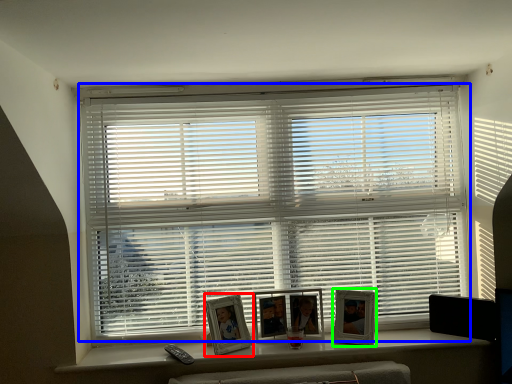
Question: Based on their relative distances, which object is nearer to picture frame (highlighted by a red box)? Choose from window blind (highlighted by a blue box) and picture frame (highlighted by a green box).

Choices:
 (A) window blind
 (B) picture frame

Answer: (B)